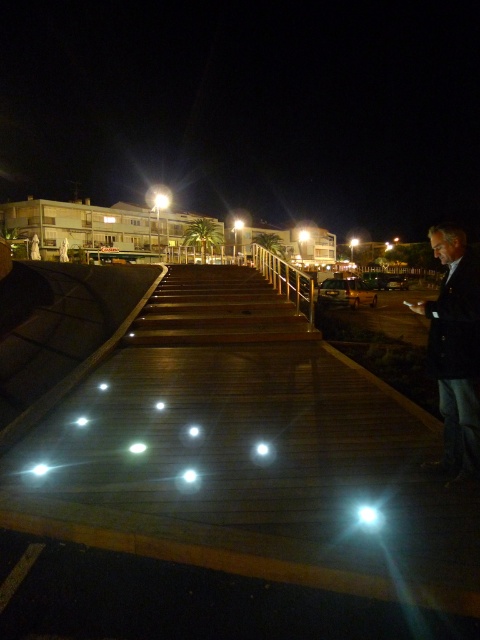
You are a security guard monitoring the walkway at night. You notice the dark blue jacket at right and the gold metallic railing at center. Which object appears bigger in the image?

The dark blue jacket at right has a larger size compared to the gold metallic railing at center, so the dark blue jacket at right appears bigger in the image.

You are a delivery robot with a 1.2 meter wide package. You need to move from your current position to the gold metallic railing at center while avoiding the dark blue jacket at right. Is there enough space between them for you to pass through?

The distance between the dark blue jacket at right and the gold metallic railing at center is 4.54 meters. Since your package is 1.2 meters wide, there is sufficient space to pass through safely.

You are standing at the end of the walkway and want to approach the person wearing the dark blue jacket at right. The walkway is 12 feet long. Can you reach the person before the walkway ends?

The distance between the dark blue jacket at right and the viewer is 11.32 feet, which is less than the 12 foot length of the walkway. Therefore, you can reach the person before the walkway ends.